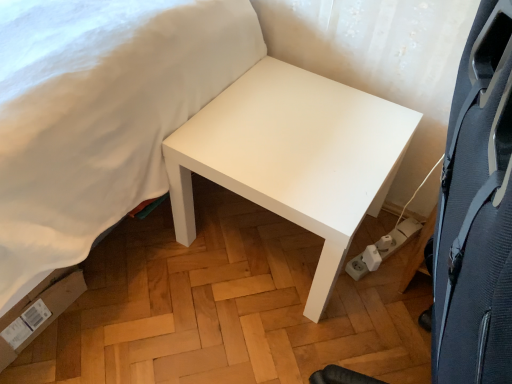
Question: Considering the relative positions of white plastic socket at lower right and black textured swivel chair at right in the image provided, is white plastic socket at lower right to the left of black textured swivel chair at right from the viewer's perspective?

Choices:
 (A) yes
 (B) no

Answer: (B)

Question: Is white plastic socket at lower right looking in the opposite direction of black textured swivel chair at right?

Choices:
 (A) yes
 (B) no

Answer: (B)

Question: From a real-world perspective, is white plastic socket at lower right on black textured swivel chair at right?

Choices:
 (A) yes
 (B) no

Answer: (B)

Question: Considering the relative sizes of white plastic socket at lower right and black textured swivel chair at right in the image provided, is white plastic socket at lower right bigger than black textured swivel chair at right?

Choices:
 (A) yes
 (B) no

Answer: (B)

Question: Can you confirm if white plastic socket at lower right is shorter than black textured swivel chair at right?

Choices:
 (A) yes
 (B) no

Answer: (A)

Question: Is white plastic socket at lower right closer to the viewer compared to black textured swivel chair at right?

Choices:
 (A) yes
 (B) no

Answer: (B)

Question: Is black textured swivel chair at right with white matte table at center?

Choices:
 (A) no
 (B) yes

Answer: (A)

Question: Can you confirm if black textured swivel chair at right is taller than white matte table at center?

Choices:
 (A) yes
 (B) no

Answer: (A)

Question: Considering the relative sizes of black textured swivel chair at right and white matte table at center in the image provided, is black textured swivel chair at right thinner than white matte table at center?

Choices:
 (A) no
 (B) yes

Answer: (B)

Question: Would you say black textured swivel chair at right is outside white matte table at center?

Choices:
 (A) no
 (B) yes

Answer: (B)

Question: Is black textured swivel chair at right oriented towards white matte table at center?

Choices:
 (A) yes
 (B) no

Answer: (B)

Question: From the image's perspective, is black textured swivel chair at right located above white matte table at center?

Choices:
 (A) no
 (B) yes

Answer: (A)

Question: Is white matte bed at upper left turned away from white plastic socket at lower right?

Choices:
 (A) no
 (B) yes

Answer: (A)